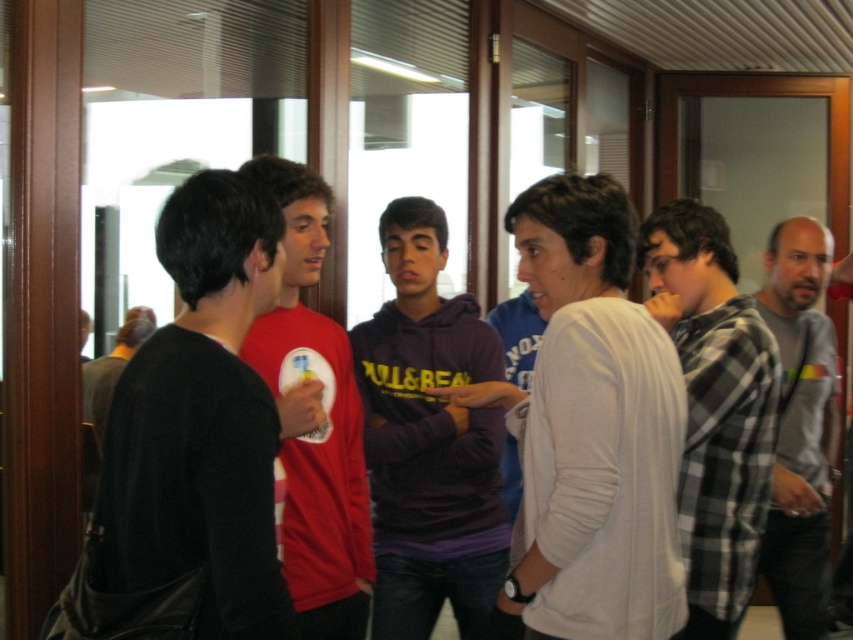
Question: Based on their relative distances, which object is nearer to the black leather jacket at left?

Choices:
 (A) purple fleece at center
 (B) plaid flannel shirt at right
 (C) gray cotton shirt at right

Answer: (A)

Question: Which point is farther from the camera taking this photo?

Choices:
 (A) (312, 592)
 (B) (380, 509)
 (C) (161, 384)
 (D) (598, 618)

Answer: (B)

Question: Is plaid flannel shirt at right smaller than gray cotton shirt at right?

Choices:
 (A) yes
 (B) no

Answer: (A)

Question: Which of these objects is positioned farthest from the gray cotton shirt at right?

Choices:
 (A) white cotton sweater at center
 (B) plaid flannel shirt at right
 (C) red matte shirt at center

Answer: (C)

Question: Considering the relative positions of white cotton sweater at center and black leather jacket at left in the image provided, where is white cotton sweater at center located with respect to black leather jacket at left?

Choices:
 (A) above
 (B) below

Answer: (B)

Question: Does black leather jacket at left have a larger size compared to plaid flannel shirt at right?

Choices:
 (A) no
 (B) yes

Answer: (A)